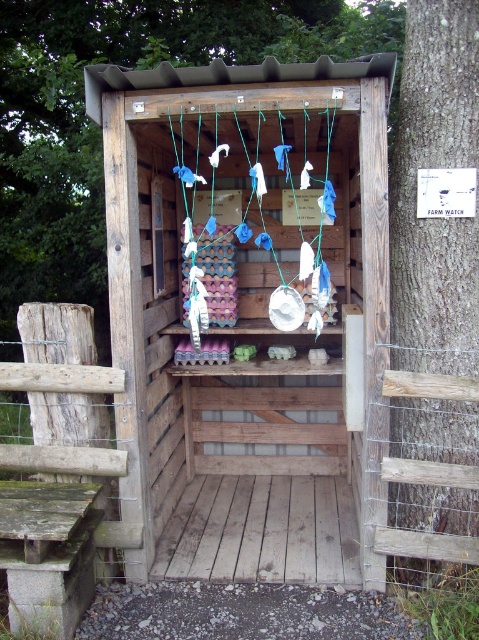
Question: Can you confirm if wooden hut at center is smaller than smooth bark tree at right?

Choices:
 (A) no
 (B) yes

Answer: (A)

Question: Can you confirm if wooden hut at center is bigger than smooth bark tree at right?

Choices:
 (A) no
 (B) yes

Answer: (B)

Question: Which object appears closest to the camera in this image?

Choices:
 (A) smooth bark tree at right
 (B) wooden hut at center

Answer: (B)

Question: Is wooden hut at center bigger than smooth bark tree at right?

Choices:
 (A) no
 (B) yes

Answer: (B)